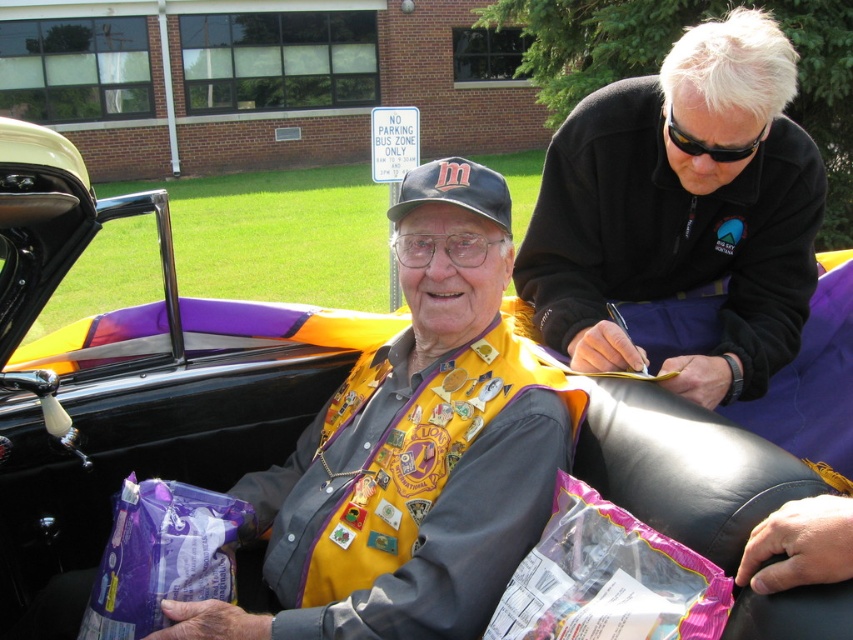
You are a photographer taking a picture of the black matte jacket at upper right and the purple plastic bag at lower left. Which object should you focus on first if you want to capture both in clear detail?

The black matte jacket at upper right is taller than the purple plastic bag at lower left, so you should focus on the black matte jacket at upper right first to ensure both are in clear detail.

You are standing near the vintage convertible car and want to take a photo of the person wearing the black matte jacket at upper right. The camera you have is 1.66 meters away from the jacket. Is the camera close enough to capture a clear photo of the person?

The black matte jacket at upper right and camera are 1.66 meters apart from each other. Since the camera is positioned exactly 1.66 meters away from the jacket, it should be close enough to capture a clear photo of the person wearing the jacket, provided there are no obstructions.